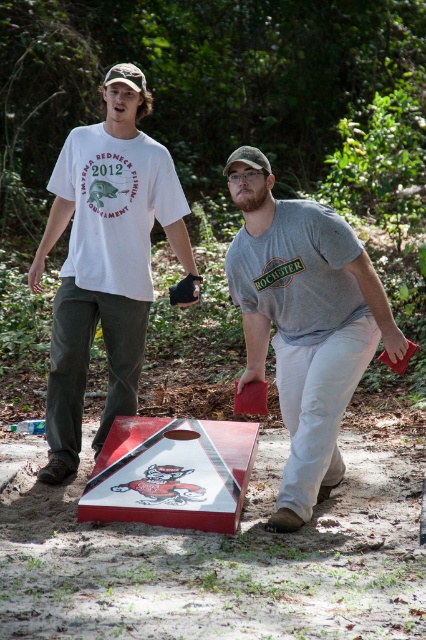
Looking at this image, does matte red cornhole board at center appear on the left side of camouflage fabric baseball cap at center?

No, matte red cornhole board at center is not to the left of camouflage fabric baseball cap at center.

Is matte red cornhole board at center to the right of camouflage fabric baseball cap at center from the viewer's perspective?

Indeed, matte red cornhole board at center is positioned on the right side of camouflage fabric baseball cap at center.

Locate an element on the screen. matte red cornhole board at center is located at coordinates (305, 324).

The width and height of the screenshot is (426, 640). I want to click on matte red cornhole board at center, so click(x=305, y=324).

Is gray cotton t-shirt at center closer to the viewer compared to red wood cornhole board at center?

No, it is behind red wood cornhole board at center.

Does gray cotton t-shirt at center appear on the left side of red wood cornhole board at center?

No, gray cotton t-shirt at center is not to the left of red wood cornhole board at center.

Locate an element on the screen. gray cotton t-shirt at center is located at coordinates (305, 324).

Is gray cotton t-shirt at center to the left of white cotton t-shirt at upper left from the viewer's perspective?

In fact, gray cotton t-shirt at center is to the right of white cotton t-shirt at upper left.

Image resolution: width=426 pixels, height=640 pixels. Describe the element at coordinates (305, 324) in the screenshot. I see `gray cotton t-shirt at center` at that location.

Is point (382, 330) less distant than point (149, 150)?

Yes, point (382, 330) is closer to viewer.

What are the coordinates of `gray cotton t-shirt at center` in the screenshot? It's located at (305, 324).